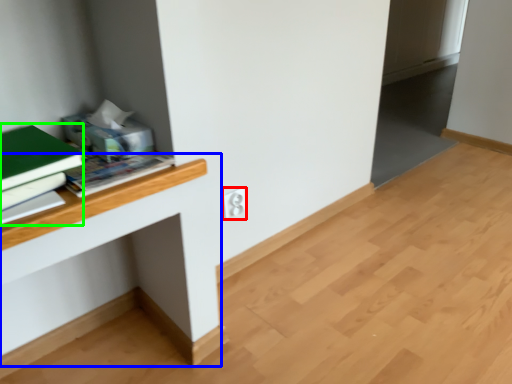
Question: Considering the real-world distances, which object is farthest from electric outlet (highlighted by a red box)? computer desk (highlighted by a blue box) or paperback book (highlighted by a green box)?

Choices:
 (A) computer desk
 (B) paperback book

Answer: (B)